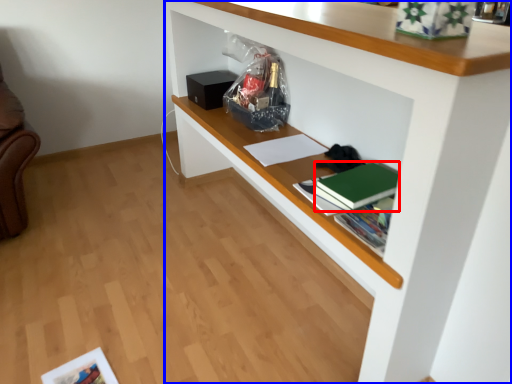
Question: Which object is further to the camera taking this photo, paperback book (highlighted by a red box) or shelf (highlighted by a blue box)?

Choices:
 (A) paperback book
 (B) shelf

Answer: (A)